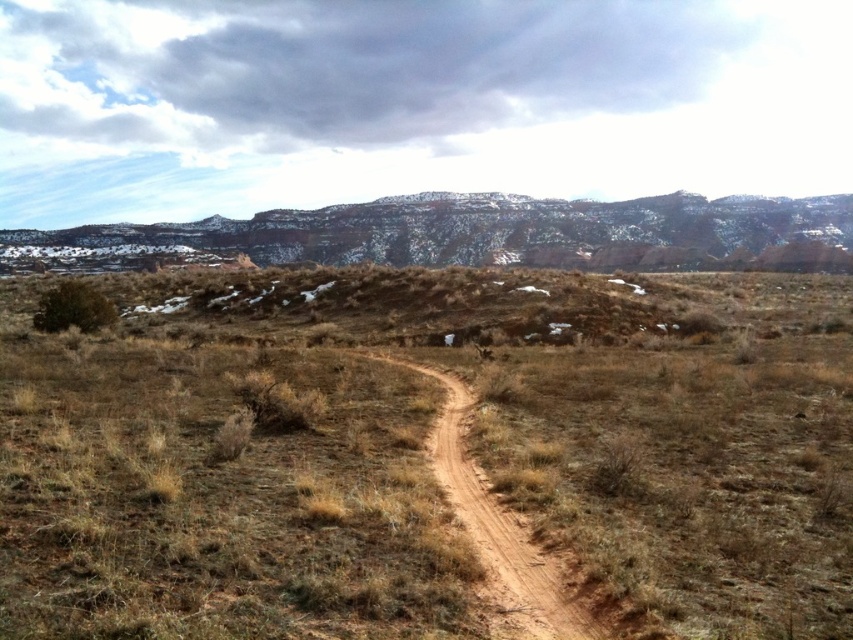
This screenshot has width=853, height=640. What do you see at coordinates (422, 456) in the screenshot?
I see `brown dirt path at center` at bounding box center [422, 456].

Measure the distance between brown dirt path at center and rustic stone mountain at upper center.

brown dirt path at center and rustic stone mountain at upper center are 314.82 meters apart from each other.

Who is more forward, (605, 522) or (740, 221)?

Positioned in front is point (605, 522).

Image resolution: width=853 pixels, height=640 pixels. I want to click on brown dirt path at center, so click(x=422, y=456).

Is brown dirt path at center positioned at the back of brown dirt track at center?

No, it is in front of brown dirt track at center.

Who is more forward, (175, 604) or (479, 550)?

Positioned in front is point (175, 604).

Which is in front, point (44, 346) or point (515, 572)?

Point (515, 572)

At what (x,y) coordinates should I click in order to perform the action: click on brown dirt path at center. Please return your answer as a coordinate pair (x, y). This screenshot has width=853, height=640. Looking at the image, I should click on (422, 456).

What do you see at coordinates (498, 234) in the screenshot? I see `rustic stone mountain at upper center` at bounding box center [498, 234].

Image resolution: width=853 pixels, height=640 pixels. Identify the location of rustic stone mountain at upper center. (498, 234).